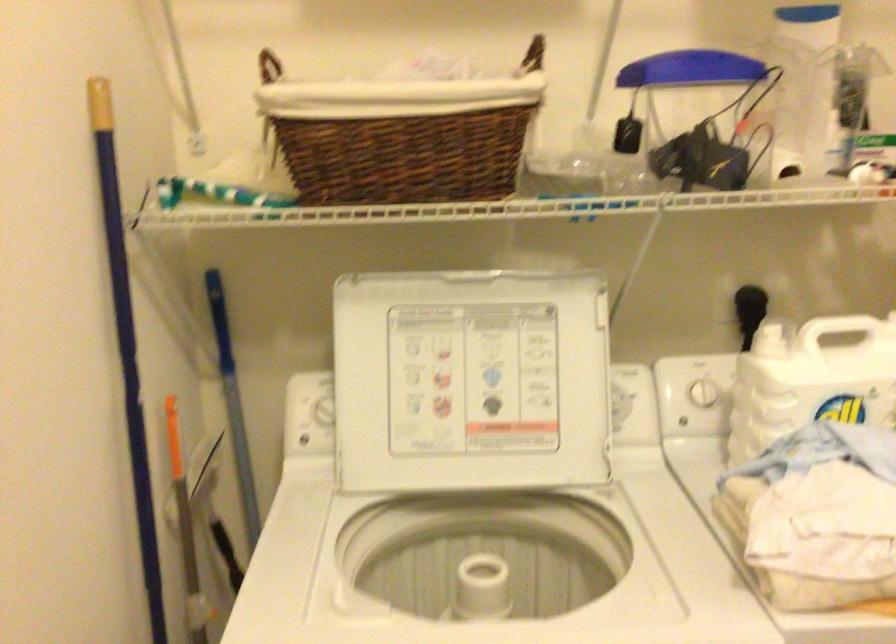
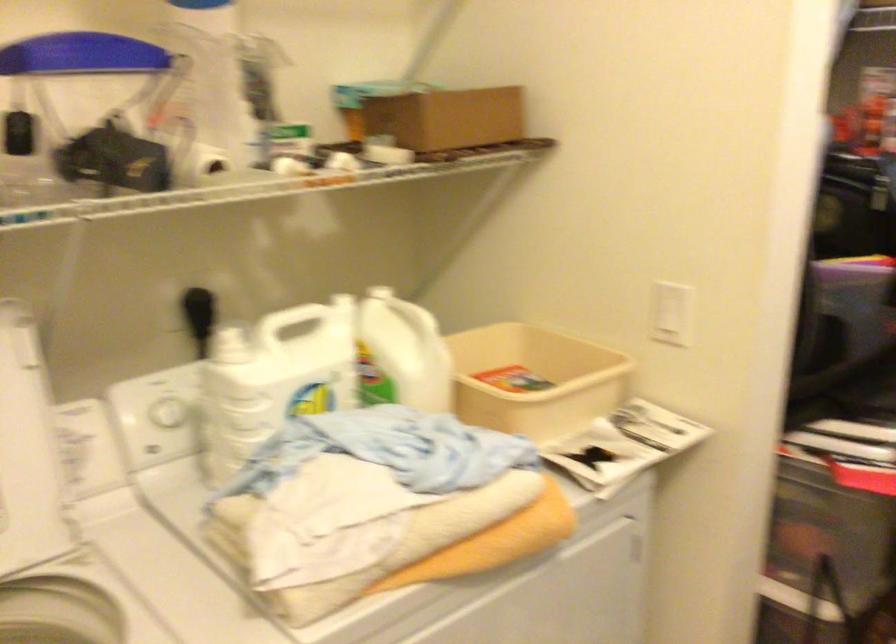
Locate, in the second image, the point that corresponds to (807,384) in the first image.

(273, 379)